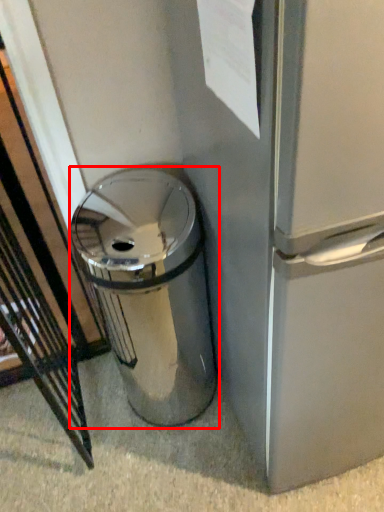
Question: Where is waste container (annotated by the red box) located in relation to paper in the image?

Choices:
 (A) right
 (B) left

Answer: (B)